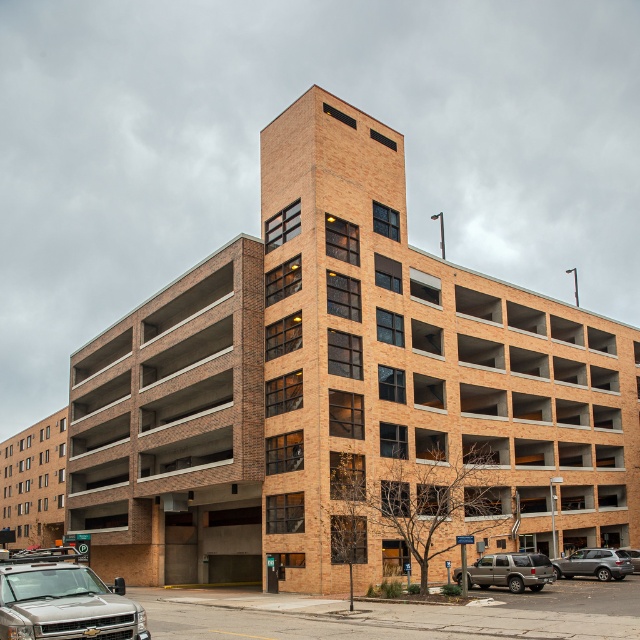
You are a delivery driver who needs to park your truck between the silver metallic suv at lower left and the metallic silver suv at lower right. Your truck is 1.8 meters tall. Can you fit your truck between them?

The silver metallic suv at lower left is taller than the metallic silver suv at lower right. Since your truck is 1.8 meters tall, you need to check the height of the lower suv. However, the description only states the relative height between the two SUVs but does not provide specific measurements. Therefore, it is uncertain if the truck will fit without knowing the exact height of the shorter SUV.

You are a delivery driver who needs to park your vehicle between two SUVs in the parking lot. You see a metallic silver suv at lower right and a silver metallic suv at lower right. Which SUV should you park to the left of?

You should park to the left of the silver metallic suv at lower right because the metallic silver suv at lower right is already positioned on the left side of it.